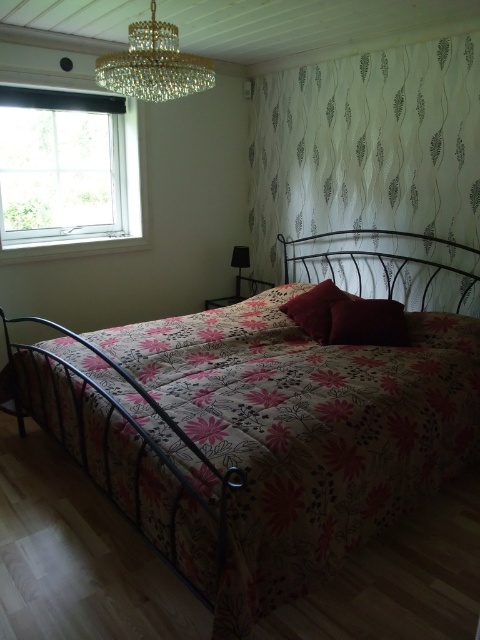
Question: In this image, where is floral-patterned fabric bed at center located relative to velvet red pillow at center?

Choices:
 (A) below
 (B) above

Answer: (A)

Question: Which object is positioned farthest from the velvet red pillow at center?

Choices:
 (A) brown velvet pillow at center
 (B) white textured curtain at upper center
 (C) crystal chandelier at upper center
 (D) floral-patterned fabric bed at center

Answer: (C)

Question: Does brown velvet pillow at center have a greater width compared to black glass lamp at center?

Choices:
 (A) no
 (B) yes

Answer: (B)

Question: Does floral-patterned fabric bed at center have a greater width compared to white plastic window at upper left?

Choices:
 (A) no
 (B) yes

Answer: (B)

Question: Which object is the farthest from the white textured curtain at upper center?

Choices:
 (A) white plastic window at upper left
 (B) floral-patterned fabric bed at center
 (C) brown velvet pillow at center
 (D) crystal chandelier at upper center

Answer: (D)

Question: Estimate the real-world distances between objects in this image. Which object is farther from the brown velvet pillow at center?

Choices:
 (A) black glass lamp at center
 (B) floral-patterned fabric bed at center
 (C) crystal chandelier at upper center

Answer: (C)